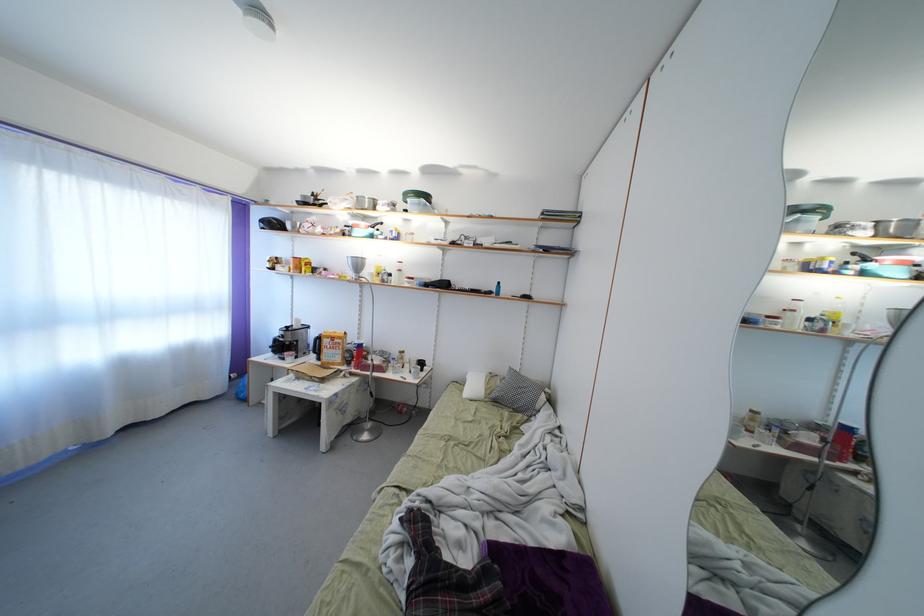
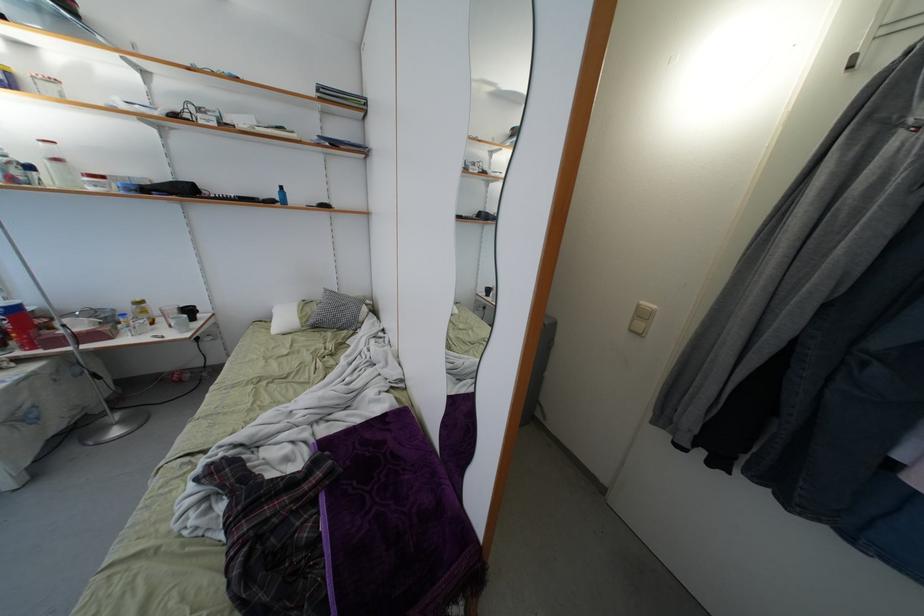
The point at (362, 361) is marked in the first image. Where is the corresponding point in the second image?

(22, 333)